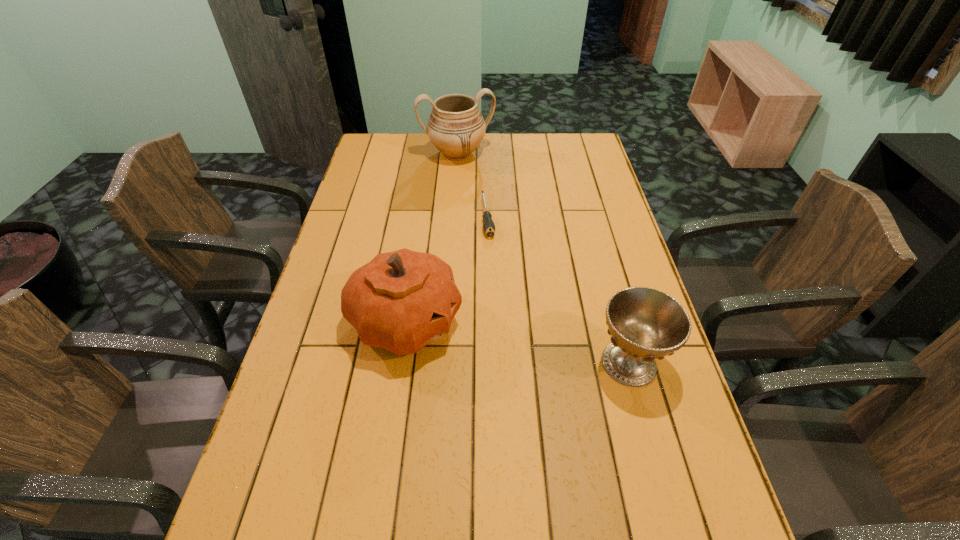
Where is `vacant space located 0.350m on the front-facing side of the urn`? The width and height of the screenshot is (960, 540). vacant space located 0.350m on the front-facing side of the urn is located at coordinates (485, 226).

This screenshot has width=960, height=540. In order to click on free space located at the tip of the shortest object in this screenshot , I will do `click(502, 313)`.

Locate an element on the screen. The width and height of the screenshot is (960, 540). vacant space located at the tip of the shortest object is located at coordinates (494, 266).

What are the coordinates of `vacant space located at the tip of the shortest object` in the screenshot? It's located at (500, 301).

This screenshot has width=960, height=540. Find the location of `object situated at the far edge`. object situated at the far edge is located at coordinates (456, 127).

This screenshot has height=540, width=960. Identify the location of object that is positioned at the left edge. (401, 301).

In order to click on object located at the right edge in this screenshot , I will do `click(645, 324)`.

Where is `vacant space at the far edge of the desktop`? vacant space at the far edge of the desktop is located at coordinates (412, 164).

Find the location of a particular element. This screenshot has width=960, height=540. vacant point at the near edge is located at coordinates [579, 496].

Where is `vacant space at the right edge`? This screenshot has height=540, width=960. vacant space at the right edge is located at coordinates (594, 171).